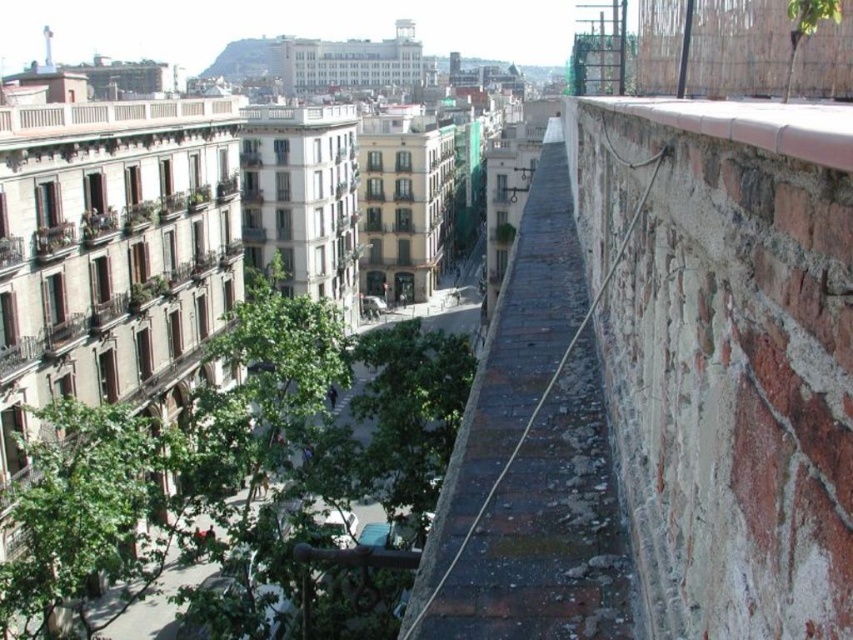
You are standing on the rooftop and want to move from the green leafy tree at center to the smooth concrete ledge at upper right. In which direction should you move?

You should move to the right because the green leafy tree at center is to the left of the smooth concrete ledge at upper right.

You are standing at the edge of the brick wall and want to determine which of the two points, point (543, 387) or point (692, 122), is closer to you. Based on the scene, which point is nearer?

Point (543, 387) is closer to you because it is further to the viewer than point (692, 122).

You are standing on the rooftop and looking at the city. There is a point marked at coordinates (234, 456). What can you see at that point?

At point (234, 456) lies green leafy tree at center.